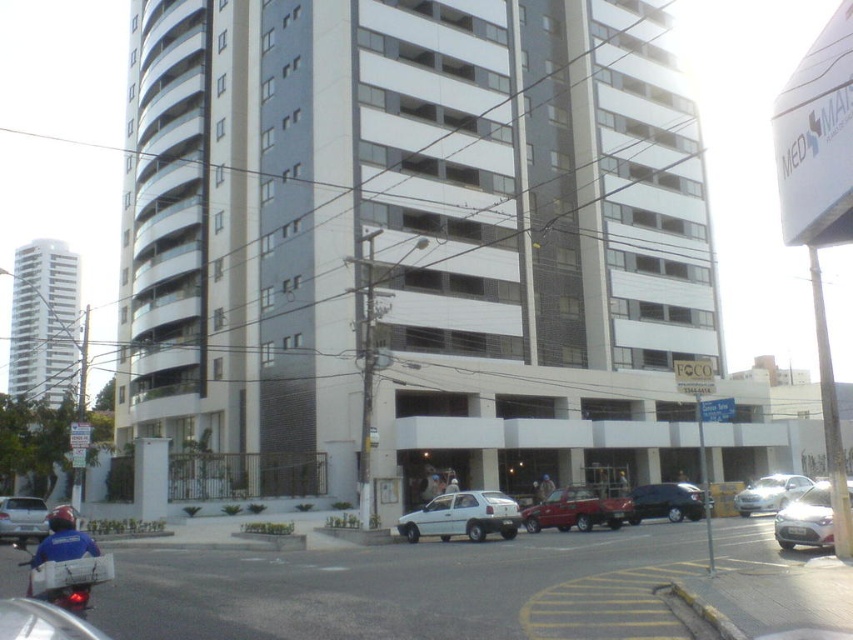
Who is positioned more to the right, white matte hatchback at center or metallic red pickup truck at center?

metallic red pickup truck at center is more to the right.

Based on the photo, is white matte hatchback at center further to camera compared to metallic red pickup truck at center?

That is False.

Does point (439, 522) lie behind point (589, 509)?

That is False.

This screenshot has width=853, height=640. Identify the location of white matte hatchback at center. (462, 516).

Who is more distant from viewer, (80, 554) or (32, 508)?

Positioned behind is point (32, 508).

Who is more forward, (32, 582) or (16, 502)?

Positioned in front is point (32, 582).

This screenshot has width=853, height=640. What are the coordinates of `metallic silver motorcycle at lower left` in the screenshot? It's located at (67, 572).

Can you confirm if metallic silver motorcycle at lower left is bigger than satin silver sedan at lower right?

Incorrect, metallic silver motorcycle at lower left is not larger than satin silver sedan at lower right.

Can you confirm if metallic silver motorcycle at lower left is smaller than satin silver sedan at lower right?

Correct, metallic silver motorcycle at lower left occupies less space than satin silver sedan at lower right.

Which is in front, point (59, 605) or point (822, 532)?

Point (59, 605) is in front.

The width and height of the screenshot is (853, 640). Identify the location of metallic silver motorcycle at lower left. (67, 572).